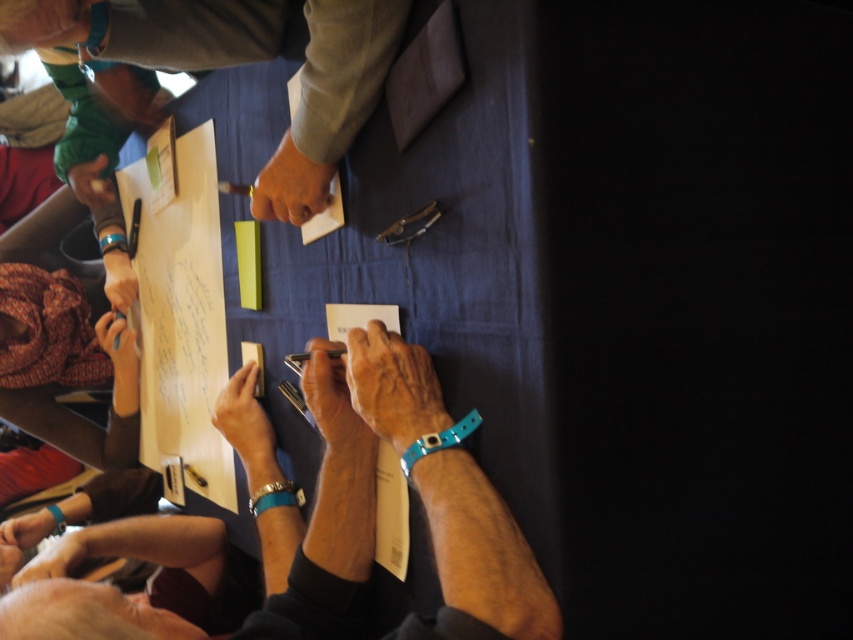
You are a photographer taking a picture of the collaborative activity. You notice the smooth leather wristband at center and the smooth skin hand at lower left. Which object is positioned higher in the image?

The smooth leather wristband at center is positioned higher than the smooth skin hand at lower left.

You are a participant in the brainstorming session and need to pass a note from the yellow paper at center to the smooth skin hand at lower left. Can you do this without moving your body?

The distance between the yellow paper at center and the smooth skin hand at lower left is 14.77 inches. Since this distance is within typical arm reach, you can likely pass the note without moving your body.

You are part of a team working on a project and need to identify which object is bigger between the smooth leather wristband at center and the smooth skin hand at lower left. Based on the scene description, which one is larger?

The smooth leather wristband at center is larger in size than the smooth skin hand at lower left.